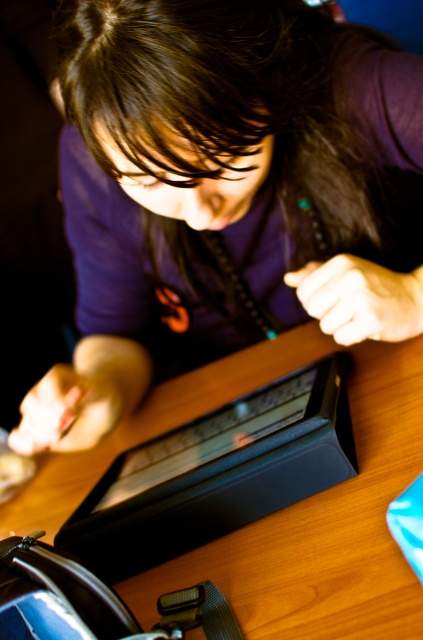
Looking at this image, can you confirm if purple matte shirt at upper center is thinner than wooden table at center?

Yes, purple matte shirt at upper center is thinner than wooden table at center.

Can you confirm if purple matte shirt at upper center is shorter than wooden table at center?

In fact, purple matte shirt at upper center may be taller than wooden table at center.

Locate an element on the screen. purple matte shirt at upper center is located at coordinates (219, 188).